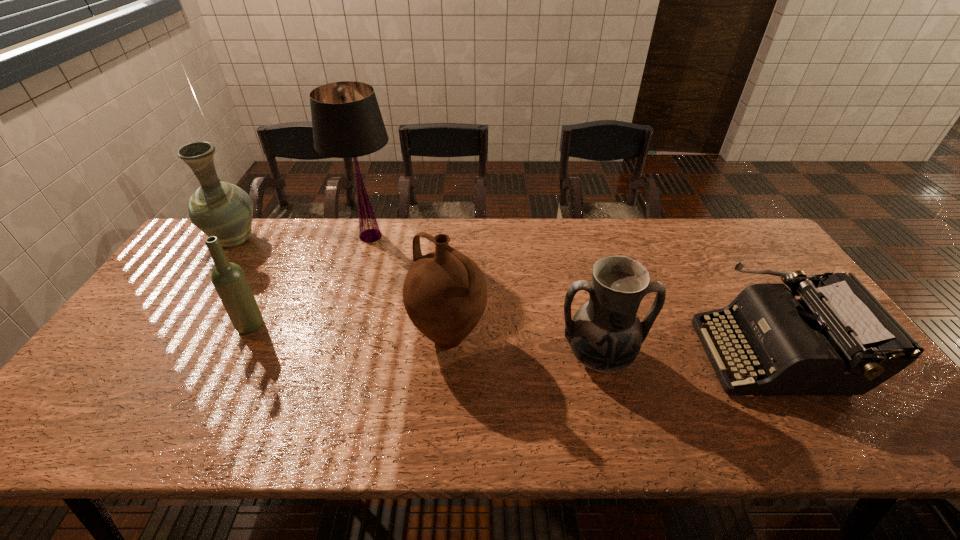
Locate an element on the screen. This screenshot has height=540, width=960. blank space located on the right of the second pitcher from right to left is located at coordinates (636, 337).

Image resolution: width=960 pixels, height=540 pixels. Identify the location of vacant space situated on the left of the fifth object from right to left. (174, 326).

The image size is (960, 540). I want to click on free space located 0.110m on the front-facing side of the second object from right to left, so (616, 428).

Locate an element on the screen. vacant region located on the front-facing side of the shortest object is located at coordinates (680, 354).

Identify the location of free region located 0.180m on the front-facing side of the shortest object. coord(633,354).

Image resolution: width=960 pixels, height=540 pixels. What are the coordinates of `vacant space situated 0.380m on the front-facing side of the shortest object` in the screenshot? It's located at (554, 354).

Image resolution: width=960 pixels, height=540 pixels. I want to click on lampshade that is at the far edge, so click(x=347, y=123).

Where is `pitcher positioned at the far edge`? This screenshot has height=540, width=960. pitcher positioned at the far edge is located at coordinates (217, 208).

Where is `object that is at the near edge`? The image size is (960, 540). object that is at the near edge is located at coordinates (837, 339).

This screenshot has width=960, height=540. Find the location of `object that is at the left edge`. object that is at the left edge is located at coordinates (217, 208).